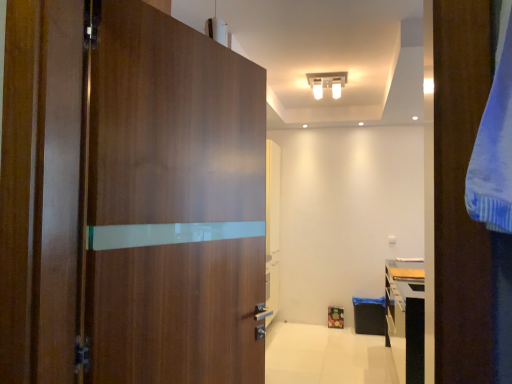
Where is `matte wood door at left`? Image resolution: width=512 pixels, height=384 pixels. matte wood door at left is located at coordinates (174, 204).

This screenshot has width=512, height=384. Describe the element at coordinates (174, 204) in the screenshot. I see `matte wood door at left` at that location.

The image size is (512, 384). I want to click on matte wood door at left, so click(174, 204).